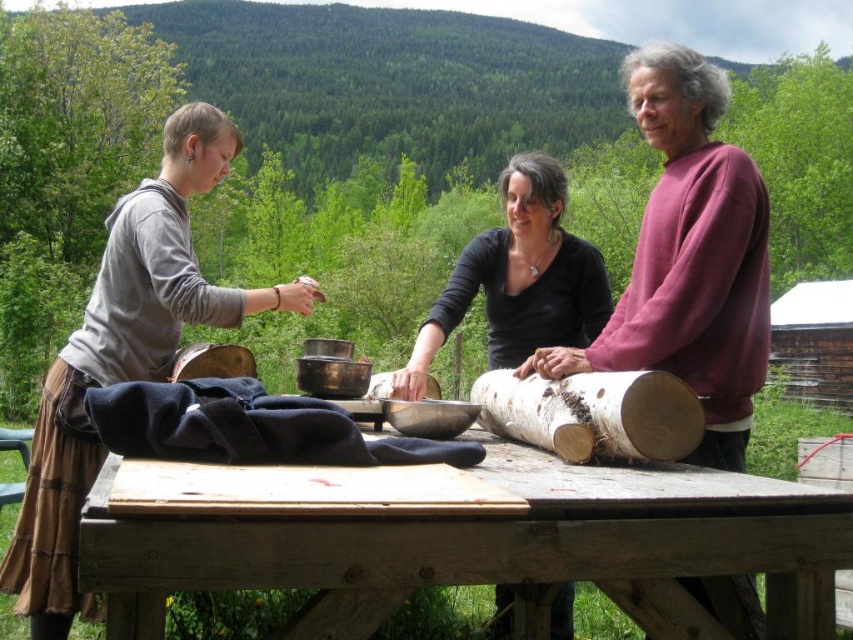
You are standing at the origin point of the coordinate system in the image. The purple cotton sweater at upper right is located at point (689, 257). If you want to move towards the purple cotton sweater at upper right, which direction should you go?

The purple cotton sweater at upper right is located at point (689, 257), so you should move northeast to reach it.

Based on the scene description, where is the wooden table located in relation to the individuals? Please provide coordinates in the format of a point, such as point (494,547).

The wooden table is located at point (494,547), which is at the center of the scene.